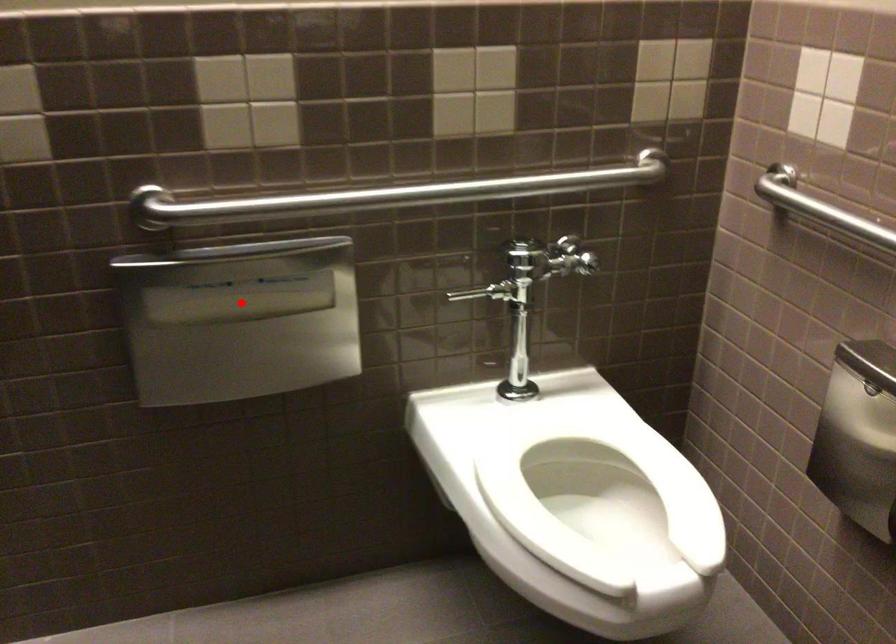
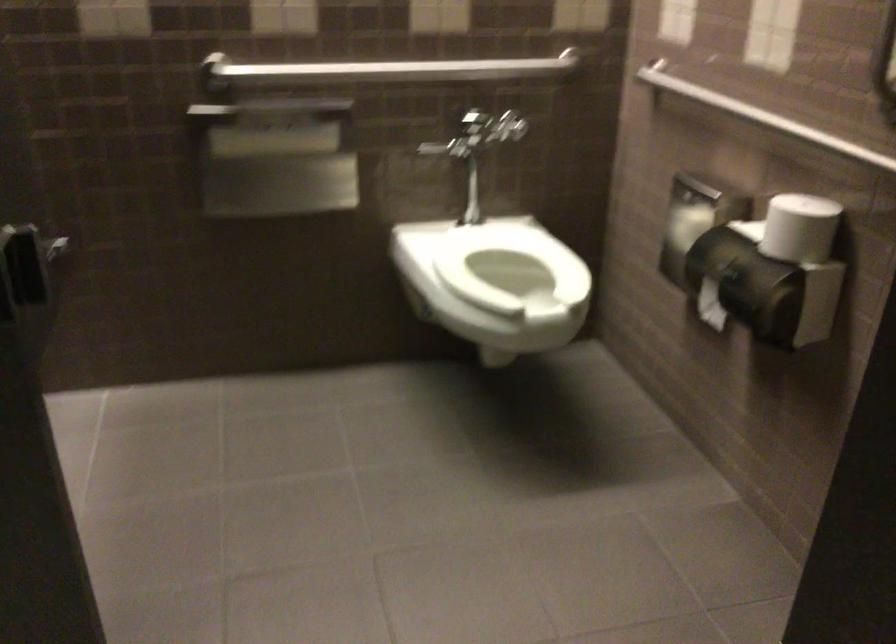
Question: I am providing you with two images of the same scene from different viewpoints. In image1, a red point is highlighted. Considering the same 3D point in image2, which of the following is correct?

Choices:
 (A) It is closer
 (B) It is farther

Answer: (B)